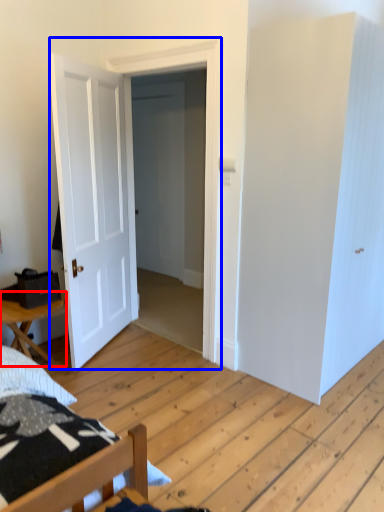
Question: Which object is closer to the camera taking this photo, table (highlighted by a red box) or door (highlighted by a blue box)?

Choices:
 (A) table
 (B) door

Answer: (A)